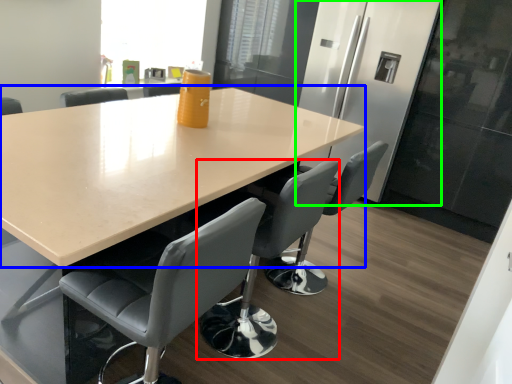
Question: Which object is the closest to the chair (highlighted by a red box)? Choose among these: table (highlighted by a blue box) or fridge (highlighted by a green box).

Choices:
 (A) table
 (B) fridge

Answer: (A)